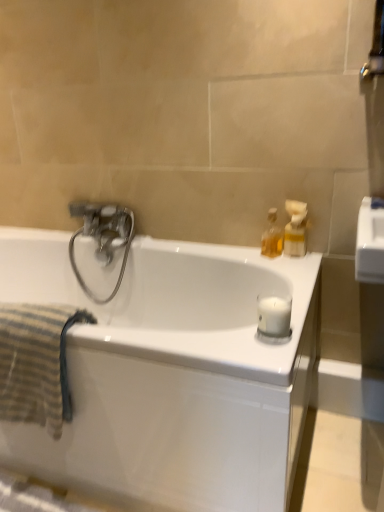
The width and height of the screenshot is (384, 512). What are the coordinates of `white matte candle at right` in the screenshot? It's located at (274, 316).

This screenshot has height=512, width=384. Describe the element at coordinates (295, 228) in the screenshot. I see `translucent plastic soap dispenser at upper right, which is counted as the 1th soap dispenser, starting from the right` at that location.

Where is `white matte candle at right`? white matte candle at right is located at coordinates (274, 316).

From a real-world perspective, is metallic silver towel bar at upper right on top of striped cotton towel at left?

Yes.

Between point (382, 9) and point (6, 353), which one is positioned in front?

The point (6, 353) is in front.

Is metallic silver towel bar at upper right next to striped cotton towel at left and touching it?

metallic silver towel bar at upper right and striped cotton towel at left are not in contact.

Visually, is metallic silver towel bar at upper right positioned to the left or to the right of striped cotton towel at left?

From the image, it's evident that metallic silver towel bar at upper right is to the right of striped cotton towel at left.

Between striped cotton towel at left and translucent glass bottle at upper right, which is counted as the 2th soap dispenser, starting from the right, which one has larger width?

striped cotton towel at left is wider.

From the image's perspective, between striped cotton towel at left and translucent glass bottle at upper right, which is counted as the 2th soap dispenser, starting from the right, which one is located above?

translucent glass bottle at upper right, which is counted as the 2th soap dispenser, starting from the right, from the image's perspective.

Is striped cotton towel at left not close to translucent glass bottle at upper right, which is counted as the 1th soap dispenser, starting from the left?

No, there isn't a large distance between striped cotton towel at left and translucent glass bottle at upper right, which is counted as the 1th soap dispenser, starting from the left.

From a real-world perspective, is striped cotton towel at left above or below translucent glass bottle at upper right, which is counted as the 1th soap dispenser, starting from the left?

From a real-world perspective, striped cotton towel at left is physically below translucent glass bottle at upper right, which is counted as the 1th soap dispenser, starting from the left.

Based on the photo, from the image's perspective, between striped cotton towel at left and metallic silver towel bar at upper right, which one is located above?

metallic silver towel bar at upper right appears higher in the image.

From a real-world perspective, which is physically above, striped cotton towel at left or metallic silver towel bar at upper right?

From a 3D spatial view, metallic silver towel bar at upper right is above.

Is striped cotton towel at left aimed at metallic silver towel bar at upper right?

No, striped cotton towel at left is not aimed at metallic silver towel bar at upper right.

Can you confirm if metallic silver towel bar at upper right is wider than polished chrome faucet at upper left?

No.

Based on the photo, from the image's perspective, would you say metallic silver towel bar at upper right is positioned over polished chrome faucet at upper left?

Yes, from the image's perspective, metallic silver towel bar at upper right is over polished chrome faucet at upper left.

Considering the positions of objects metallic silver towel bar at upper right and polished chrome faucet at upper left in the image provided, who is more to the right, metallic silver towel bar at upper right or polished chrome faucet at upper left?

Positioned to the right is metallic silver towel bar at upper right.

What's the angular difference between striped cotton towel at left and white glossy bathtub at center's facing directions?

They differ by 0.769 degrees in their facing directions.

In the scene shown: Considering the relative sizes of striped cotton towel at left and white glossy bathtub at center in the image provided, is striped cotton towel at left wider than white glossy bathtub at center?

No, striped cotton towel at left is not wider than white glossy bathtub at center.

Is striped cotton towel at left looking in the opposite direction of white glossy bathtub at center?

Yes, striped cotton towel at left is positioned with its back facing white glossy bathtub at center.

Who is more distant, striped cotton towel at left or white glossy bathtub at center?

Positioned behind is striped cotton towel at left.

Considering the points (125, 213) and (2, 312), which point is behind, point (125, 213) or point (2, 312)?

The point (125, 213) is more distant.

How many degrees apart are the facing directions of polished chrome faucet at upper left and striped cotton towel at left?

The facing directions of polished chrome faucet at upper left and striped cotton towel at left are 0.000183 degrees apart.

Is polished chrome faucet at upper left far away from striped cotton towel at left?

No.

Can you confirm if polished chrome faucet at upper left is thinner than striped cotton towel at left?

Correct, the width of polished chrome faucet at upper left is less than that of striped cotton towel at left.

Is white glossy bathtub at center completely or partially inside white matte candle at right?

No, white glossy bathtub at center is not surrounded by white matte candle at right.

From a real-world perspective, which is physically above, white matte candle at right or white glossy bathtub at center?

From a 3D spatial view, white matte candle at right is above.

Visually, is white matte candle at right positioned to the left or to the right of white glossy bathtub at center?

In the image, white matte candle at right appears on the right side of white glossy bathtub at center.

Can you confirm if white matte candle at right is bigger than white glossy bathtub at center?

No, white matte candle at right is not bigger than white glossy bathtub at center.

This screenshot has height=512, width=384. I want to click on towel bar above the striped cotton towel at left (from the image's perspective), so click(x=376, y=45).

Starting from the striped cotton towel at left, which soap dispenser is the 1st one to the right? Please provide its 2D coordinates.

[(272, 237)]

Which object lies nearer to the anchor point white glossy bathtub at center, translucent plastic soap dispenser at upper right, the 2th soap dispenser positioned from the left, or metallic silver towel bar at upper right?

Among the two, translucent plastic soap dispenser at upper right, the 2th soap dispenser positioned from the left, is located nearer to white glossy bathtub at center.

Looking at the image, which one is located closer to white matte candle at right, striped cotton towel at left or polished chrome faucet at upper left?

striped cotton towel at left lies closer to white matte candle at right than the other object.

From the image, which object appears to be nearer to metallic silver towel bar at upper right, translucent glass bottle at upper right, which is counted as the 1th soap dispenser, starting from the left, or white glossy bathtub at center?

Among the two, translucent glass bottle at upper right, which is counted as the 1th soap dispenser, starting from the left, is located nearer to metallic silver towel bar at upper right.

Looking at the image, which one is located further to translucent glass bottle at upper right, which is counted as the 1th soap dispenser, starting from the left, white glossy bathtub at center or translucent plastic soap dispenser at upper right, which is counted as the 1th soap dispenser, starting from the right?

white glossy bathtub at center.

From the image, which object appears to be nearer to white glossy bathtub at center, striped cotton towel at left or white matte candle at right?

Among the two, striped cotton towel at left is located nearer to white glossy bathtub at center.

Which object lies further to the anchor point polished chrome faucet at upper left, white glossy bathtub at center or striped cotton towel at left?

Among the two, striped cotton towel at left is located further to polished chrome faucet at upper left.

Looking at the image, which one is located closer to white glossy bathtub at center, white matte candle at right or translucent plastic soap dispenser at upper right, which is counted as the 1th soap dispenser, starting from the right?

Based on the image, white matte candle at right appears to be nearer to white glossy bathtub at center.

Based on their spatial positions, is white glossy bathtub at center or polished chrome faucet at upper left closer to white matte candle at right?

white glossy bathtub at center is positioned closer to the anchor white matte candle at right.

Find the location of a particular element. The image size is (384, 512). bathtub located between striped cotton towel at left and metallic silver towel bar at upper right in the left-right direction is located at coordinates pyautogui.click(x=158, y=367).

At what (x,y) coordinates should I click in order to perform the action: click on soap dispenser situated between polished chrome faucet at upper left and translucent plastic soap dispenser at upper right, which is counted as the 1th soap dispenser, starting from the right, from left to right. Please return your answer as a coordinate pair (x, y). Image resolution: width=384 pixels, height=512 pixels. Looking at the image, I should click on (272, 237).

Where is `soap dispenser situated between striped cotton towel at left and translucent plastic soap dispenser at upper right, the 2th soap dispenser positioned from the left, from left to right`? The width and height of the screenshot is (384, 512). soap dispenser situated between striped cotton towel at left and translucent plastic soap dispenser at upper right, the 2th soap dispenser positioned from the left, from left to right is located at coordinates (272, 237).

Where is `tap situated between white glossy bathtub at center and translucent plastic soap dispenser at upper right, which is counted as the 1th soap dispenser, starting from the right, from left to right`? Image resolution: width=384 pixels, height=512 pixels. tap situated between white glossy bathtub at center and translucent plastic soap dispenser at upper right, which is counted as the 1th soap dispenser, starting from the right, from left to right is located at coordinates pos(103,237).